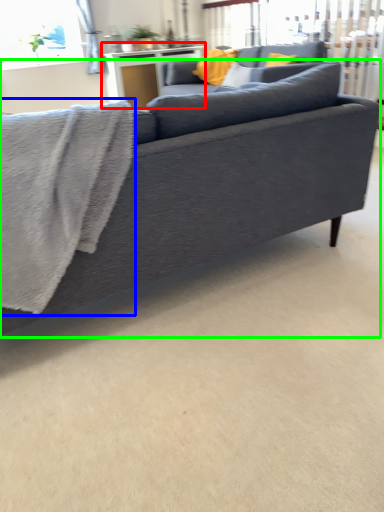
Question: Which object is the farthest from table (highlighted by a red box)? Choose among these: bath towel (highlighted by a blue box) or studio couch (highlighted by a green box).

Choices:
 (A) bath towel
 (B) studio couch

Answer: (A)